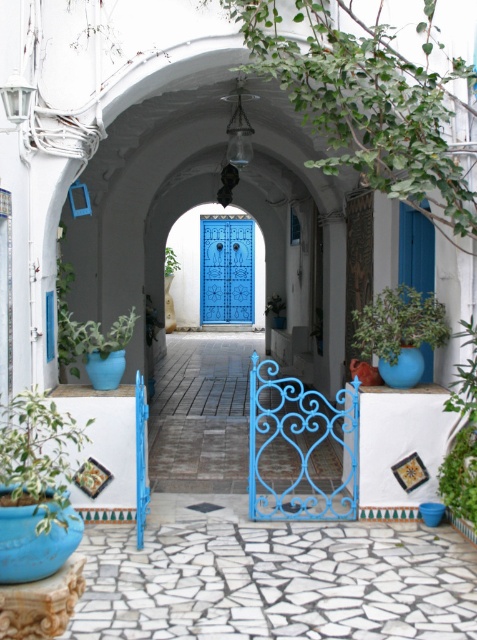
From the picture: You are standing in the alleyway and see the blue matte door at right and the green leafy plant at center. If you want to reach the door first, which direction should you walk towards?

You should walk towards the blue matte door at right because it is closer to you than the green leafy plant at center, as the distance between them is 15.09 meters.

From the picture: You are a delivery person carrying a heavy package and need to walk through the alleyway. There are two green leafy plants in your path. The first is the green leafy plant at lower right, and the second is the green leafy plant at center. Can you safely walk between them without hitting your package?

The distance between the green leafy plant at lower right and the green leafy plant at center is 17.50 meters, which is more than enough space for a delivery person to walk through safely with a heavy package.

You are a delivery person trying to navigate through the alleyway. The blue painted wood door at center is your destination. There is a green matte plant at lower right blocking your path. Can you walk around it to reach the door without getting too close?

The blue painted wood door at center and green matte plant at lower right are 54.21 feet apart from each other. Since the distance between them is quite large, you can easily walk around the green matte plant at lower right to reach the door without getting too close.